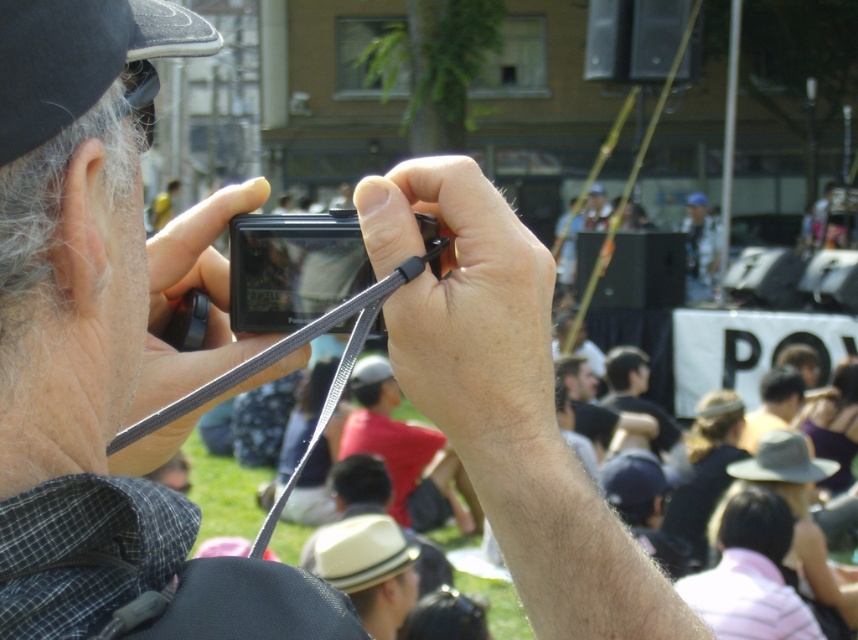
Question: Which point is closer to the camera?

Choices:
 (A) (707, 234)
 (B) (237, 220)

Answer: (B)

Question: Can you confirm if black plastic camera at center is wider than blue fabric shirt at upper center?

Choices:
 (A) yes
 (B) no

Answer: (B)

Question: Among these points, which one is farthest from the camera?

Choices:
 (A) (295, 262)
 (B) (698, 260)

Answer: (B)

Question: Is black plastic camera at center further to the viewer compared to blue fabric shirt at upper center?

Choices:
 (A) yes
 (B) no

Answer: (B)

Question: Is black plastic camera at center positioned at the back of blue fabric shirt at upper center?

Choices:
 (A) yes
 (B) no

Answer: (B)